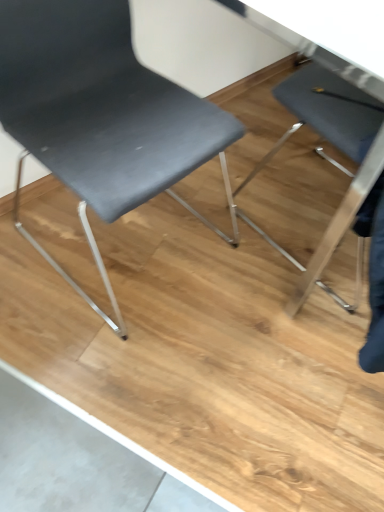
Question: From the image's perspective, is matte black chair at right, which appears as the second chair when viewed from the left, beneath matte black chair at left, marked as the first chair in a left-to-right arrangement?

Choices:
 (A) no
 (B) yes

Answer: (B)

Question: Is matte black chair at right, which appears as the second chair when viewed from the left, not near matte black chair at left, the second chair when ordered from right to left?

Choices:
 (A) yes
 (B) no

Answer: (B)

Question: From the image's perspective, is matte black chair at right, marked as the 1th chair in a right-to-left arrangement, on top of matte black chair at left, the second chair when ordered from right to left?

Choices:
 (A) no
 (B) yes

Answer: (A)

Question: Considering the relative sizes of matte black chair at right, marked as the 1th chair in a right-to-left arrangement, and matte black chair at left, the second chair when ordered from right to left, in the image provided, is matte black chair at right, marked as the 1th chair in a right-to-left arrangement, bigger than matte black chair at left, the second chair when ordered from right to left,?

Choices:
 (A) no
 (B) yes

Answer: (A)

Question: Considering the relative positions of matte black chair at right, which appears as the second chair when viewed from the left, and matte black chair at left, marked as the first chair in a left-to-right arrangement, in the image provided, is matte black chair at right, which appears as the second chair when viewed from the left, to the left of matte black chair at left, marked as the first chair in a left-to-right arrangement, from the viewer's perspective?

Choices:
 (A) yes
 (B) no

Answer: (B)

Question: Can you confirm if matte black chair at right, marked as the 1th chair in a right-to-left arrangement, is wider than matte black chair at left, marked as the first chair in a left-to-right arrangement?

Choices:
 (A) yes
 (B) no

Answer: (B)

Question: Is matte black chair at left, the second chair when ordered from right to left, closer to the viewer compared to matte black chair at right, marked as the 1th chair in a right-to-left arrangement?

Choices:
 (A) no
 (B) yes

Answer: (B)

Question: Does matte black chair at left, the second chair when ordered from right to left, have a smaller size compared to matte black chair at right, which appears as the second chair when viewed from the left?

Choices:
 (A) yes
 (B) no

Answer: (B)

Question: Is matte black chair at left, the second chair when ordered from right to left, positioned beyond the bounds of matte black chair at right, which appears as the second chair when viewed from the left?

Choices:
 (A) no
 (B) yes

Answer: (B)

Question: From a real-world perspective, is matte black chair at left, marked as the first chair in a left-to-right arrangement, physically above matte black chair at right, which appears as the second chair when viewed from the left?

Choices:
 (A) yes
 (B) no

Answer: (A)

Question: Considering the relative sizes of matte black chair at left, marked as the first chair in a left-to-right arrangement, and matte black chair at right, which appears as the second chair when viewed from the left, in the image provided, is matte black chair at left, marked as the first chair in a left-to-right arrangement, taller than matte black chair at right, which appears as the second chair when viewed from the left,?

Choices:
 (A) yes
 (B) no

Answer: (A)

Question: Is matte black chair at left, marked as the first chair in a left-to-right arrangement, wider than matte black chair at right, which appears as the second chair when viewed from the left?

Choices:
 (A) no
 (B) yes

Answer: (B)

Question: Is matte black chair at right, marked as the 1th chair in a right-to-left arrangement, to the left or to the right of matte black chair at left, the second chair when ordered from right to left, in the image?

Choices:
 (A) right
 (B) left

Answer: (A)